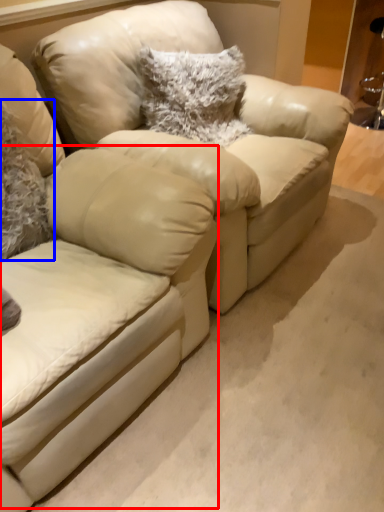
Question: Which object appears closest to the camera in this image, swivel chair (highlighted by a red box) or pillow (highlighted by a blue box)?

Choices:
 (A) swivel chair
 (B) pillow

Answer: (A)